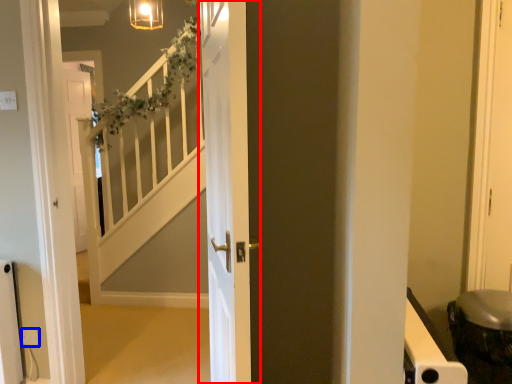
Question: Which of the following is the farthest to the observer, door (highlighted by a red box) or electric outlet (highlighted by a blue box)?

Choices:
 (A) door
 (B) electric outlet

Answer: (B)